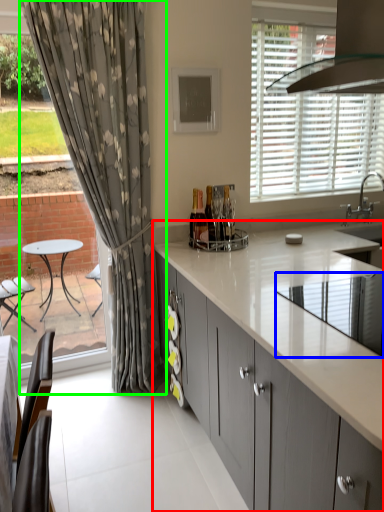
Question: Which object is the closest to the cabinetry (highlighted by a red box)? Choose among these: appliance (highlighted by a blue box) or curtain (highlighted by a green box).

Choices:
 (A) appliance
 (B) curtain

Answer: (A)